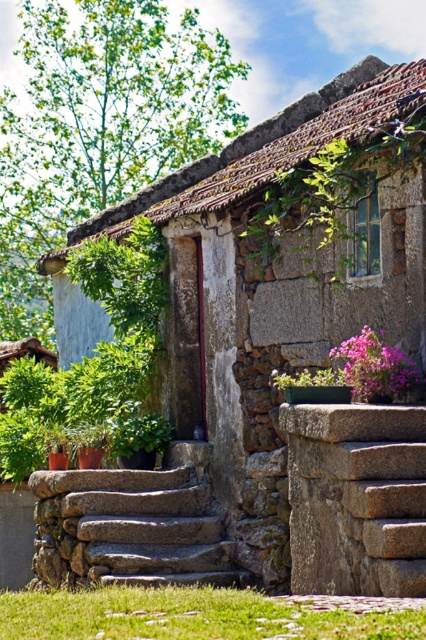
Does gray rough stone steps at center have a larger size compared to granite steps at center?

Actually, gray rough stone steps at center might be smaller than granite steps at center.

Which is behind, point (328, 502) or point (135, 508)?

The point (135, 508) is behind.

The image size is (426, 640). I want to click on gray rough stone steps at center, so click(356, 499).

Locate an element on the screen. This screenshot has height=640, width=426. gray rough stone steps at center is located at coordinates (356, 499).

Between point (37, 500) and point (405, 364), which one is positioned in front?

Point (405, 364) is more forward.

Which of these two, granite steps at center or pink matte flower at center-right, stands taller?

Standing taller between the two is granite steps at center.

The image size is (426, 640). I want to click on granite steps at center, so click(129, 529).

Is gray rough stone steps at center positioned before green grass at lower left?

No, it is not.

Between gray rough stone steps at center and green grass at lower left, which one appears on the right side from the viewer's perspective?

From the viewer's perspective, gray rough stone steps at center appears more on the right side.

Where is `gray rough stone steps at center`? The height and width of the screenshot is (640, 426). gray rough stone steps at center is located at coordinates [356, 499].